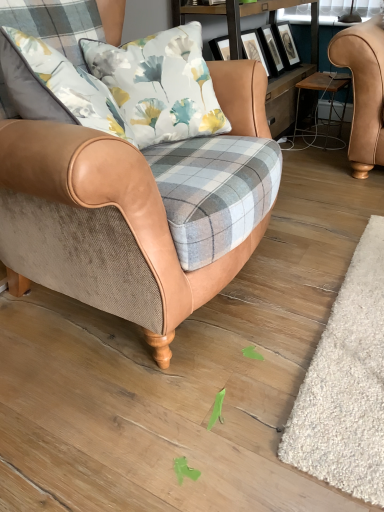
You are a GUI agent. You are given a task and a screenshot of the screen. Output one action in this format:
    pyautogui.click(x=<x>, y=<y>)
    Task: Click on the wooden stool at right
    
    Given the screenshot: What is the action you would take?
    pyautogui.click(x=323, y=94)

Where is `white shaggy rug at lower right`? Image resolution: width=384 pixels, height=512 pixels. white shaggy rug at lower right is located at coordinates (346, 384).

Visually, is tan leather armchair at center positioned to the left or to the right of wooden framed artwork at upper center?

In the image, tan leather armchair at center appears on the left side of wooden framed artwork at upper center.

Looking at this image, is tan leather armchair at center located outside wooden framed artwork at upper center?

Yes, tan leather armchair at center is located beyond the bounds of wooden framed artwork at upper center.

Is tan leather armchair at center turned away from wooden framed artwork at upper center?

No, tan leather armchair at center's orientation is not away from wooden framed artwork at upper center.

Can you tell me how much tan leather armchair at center and wooden framed artwork at upper center differ in facing direction?

1.62 degrees separate the facing orientations of tan leather armchair at center and wooden framed artwork at upper center.

Is wooden stool at right aimed at white shaggy rug at lower right?

No.

How different are the orientations of wooden stool at right and white shaggy rug at lower right in degrees?

The angular difference between wooden stool at right and white shaggy rug at lower right is 2.18 degrees.

Is point (341, 128) more distant than point (348, 349)?

Yes.

What's the angular difference between wooden stool at right and tan leather armchair at center's facing directions?

The angular difference between wooden stool at right and tan leather armchair at center is 90 degrees.

From a real-world perspective, which is physically above, wooden stool at right or tan leather armchair at center?

tan leather armchair at center, from a real-world perspective.

Which of these two, wooden stool at right or tan leather armchair at center, is bigger?

tan leather armchair at center is bigger.

Looking at this image, is wooden stool at right looking in the opposite direction of tan leather armchair at center?

No, tan leather armchair at center is not at the back of wooden stool at right.

Is white shaggy rug at lower right placed right next to wooden stool at right?

There is a gap between white shaggy rug at lower right and wooden stool at right.

Is white shaggy rug at lower right taller or shorter than wooden stool at right?

white shaggy rug at lower right is shorter than wooden stool at right.

Is point (324, 474) farther from viewer compared to point (320, 87)?

No, it is not.

Is wooden stool at right a part of white shaggy rug at lower right?

Actually, wooden stool at right is outside white shaggy rug at lower right.

Who is more distant, wooden framed artwork at upper center or tan leather armchair at center?

wooden framed artwork at upper center.

From the image's perspective, which is above, wooden framed artwork at upper center or tan leather armchair at center?

wooden framed artwork at upper center appears higher in the image.

Looking at their sizes, would you say wooden framed artwork at upper center is wider or thinner than tan leather armchair at center?

Considering their sizes, wooden framed artwork at upper center looks slimmer than tan leather armchair at center.

Can you tell me how much wooden framed artwork at upper center and tan leather armchair at center differ in facing direction?

There is a 1.62-degree angle between the facing directions of wooden framed artwork at upper center and tan leather armchair at center.

Are white shaggy rug at lower right and tan leather armchair at center making contact?

No, white shaggy rug at lower right is not making contact with tan leather armchair at center.

Considering the positions of objects white shaggy rug at lower right and tan leather armchair at center in the image provided, who is behind, white shaggy rug at lower right or tan leather armchair at center?

white shaggy rug at lower right is behind.

What's the angular difference between white shaggy rug at lower right and tan leather armchair at center's facing directions?

87.8 degrees.

Which is in front, point (286, 434) or point (51, 183)?

Point (51, 183)

Is point (29, 282) farther from viewer compared to point (340, 123)?

That is False.

At what (x,y) coordinates should I click in order to perform the action: click on stool located underneath the tan leather armchair at center (from a real-world perspective). Please return your answer as a coordinate pair (x, y). This screenshot has height=512, width=384. Looking at the image, I should click on (323, 94).

Can you tell me how much tan leather armchair at center and wooden stool at right differ in facing direction?

The angular difference between tan leather armchair at center and wooden stool at right is 90 degrees.

Is tan leather armchair at center closer to camera compared to wooden stool at right?

Yes, it is in front of wooden stool at right.

Where is `chair below the wooden framed artwork at upper center (from the image's perspective)`? Image resolution: width=384 pixels, height=512 pixels. chair below the wooden framed artwork at upper center (from the image's perspective) is located at coordinates (99, 229).

Identify the location of stool that appears on the right of white shaggy rug at lower right. Image resolution: width=384 pixels, height=512 pixels. (323, 94).

Looking at the image, which one is located further to tan leather armchair at center, wooden framed artwork at upper center or wooden stool at right?

→ wooden stool at right is further to tan leather armchair at center.

Which object lies further to the anchor point wooden stool at right, white shaggy rug at lower right or wooden framed artwork at upper center?

white shaggy rug at lower right is positioned further to the anchor wooden stool at right.

Considering their positions, is wooden stool at right positioned closer to wooden framed artwork at upper center than tan leather armchair at center?

Among the two, wooden stool at right is located nearer to wooden framed artwork at upper center.

From the image, which object appears to be farther from wooden framed artwork at upper center, tan leather armchair at center or wooden stool at right?

Based on the image, tan leather armchair at center appears to be further to wooden framed artwork at upper center.

When comparing their distances from white shaggy rug at lower right, does wooden framed artwork at upper center or wooden stool at right seem further?

wooden stool at right.

When comparing their distances from tan leather armchair at center, does white shaggy rug at lower right or wooden framed artwork at upper center seem closer?

white shaggy rug at lower right lies closer to tan leather armchair at center than the other object.

Considering their positions, is tan leather armchair at center positioned further to wooden framed artwork at upper center than white shaggy rug at lower right?

Based on the image, white shaggy rug at lower right appears to be further to wooden framed artwork at upper center.

When comparing their distances from white shaggy rug at lower right, does wooden framed artwork at upper center or tan leather armchair at center seem closer?

tan leather armchair at center.

Locate an element on the screen. This screenshot has width=384, height=512. mat between tan leather armchair at center and wooden stool at right along the z-axis is located at coordinates (346, 384).

At what (x,y) coordinates should I click in order to perform the action: click on shelf positioned between tan leather armchair at center and wooden stool at right from near to far. Please return your answer as a coordinate pair (x, y). This screenshot has height=512, width=384. Looking at the image, I should click on (290, 85).

Find the location of a particular element. chair that lies between wooden framed artwork at upper center and white shaggy rug at lower right from top to bottom is located at coordinates 99,229.

The width and height of the screenshot is (384, 512). I want to click on shelf between white shaggy rug at lower right and wooden stool at right in the front-back direction, so click(x=290, y=85).